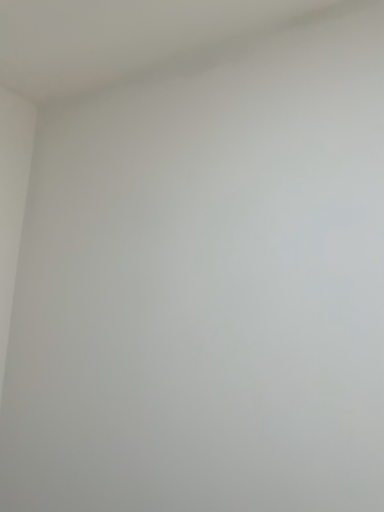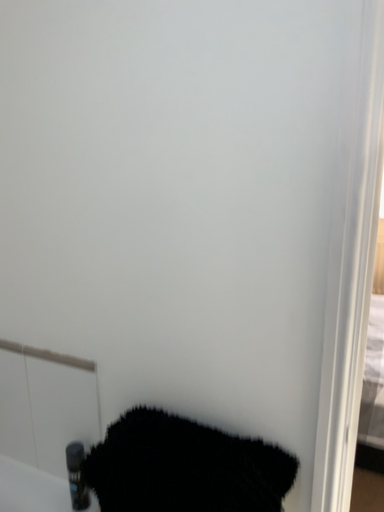
Question: How did the camera likely rotate when shooting the video?

Choices:
 (A) rotated upward
 (B) rotated downward

Answer: (B)